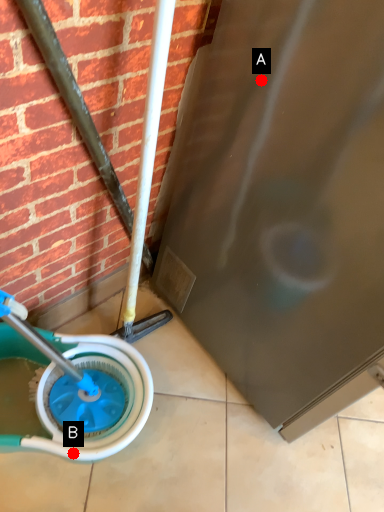
Question: Two points are circled on the image, labeled by A and B beside each circle. Which of the following is the closest to the observer?

Choices:
 (A) A is closer
 (B) B is closer

Answer: (A)